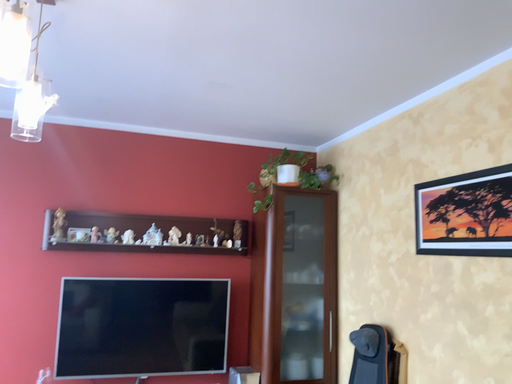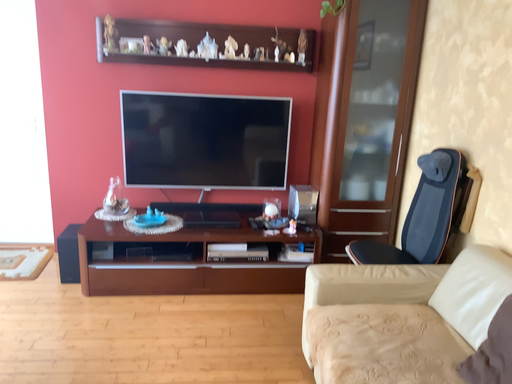
Question: How did the camera likely rotate when shooting the video?

Choices:
 (A) rotated upward
 (B) rotated downward

Answer: (B)